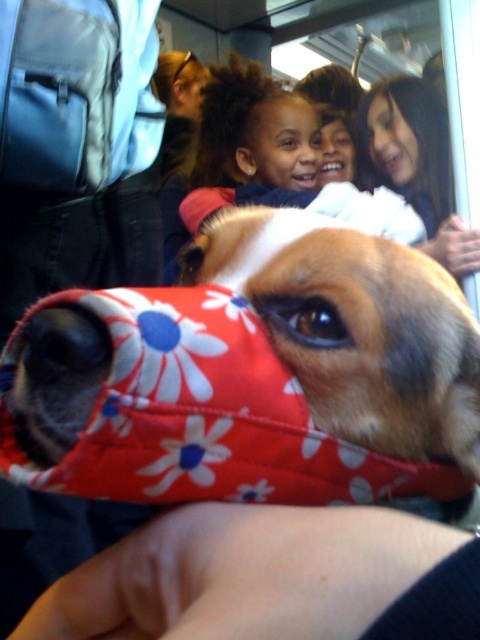
Question: Does smooth skin face at upper right come behind brown fur nose at center?

Choices:
 (A) yes
 (B) no

Answer: (B)

Question: Can you confirm if fluffy fabric dog at center is positioned to the right of smooth brown hair at upper center?

Choices:
 (A) no
 (B) yes

Answer: (A)

Question: Which of the following is the farthest from the observer?

Choices:
 (A) (192, 92)
 (B) (297, 84)

Answer: (B)

Question: Does fluffy fabric dog at center appear under matte black hair at upper center?

Choices:
 (A) yes
 (B) no

Answer: (A)

Question: Which point is closer to the camera taking this photo?

Choices:
 (A) (309, 148)
 (B) (181, 104)
 (C) (260, 168)

Answer: (C)

Question: Among these points, which one is nearest to the camera?

Choices:
 (A) (474, 419)
 (B) (382, 118)

Answer: (A)